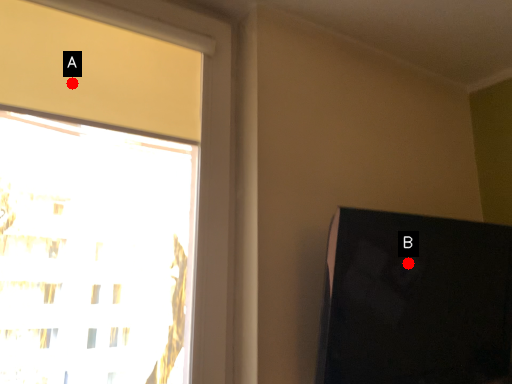
Question: Two points are circled on the image, labeled by A and B beside each circle. Among these points, which one is farthest from the camera?

Choices:
 (A) A is further
 (B) B is further

Answer: (B)